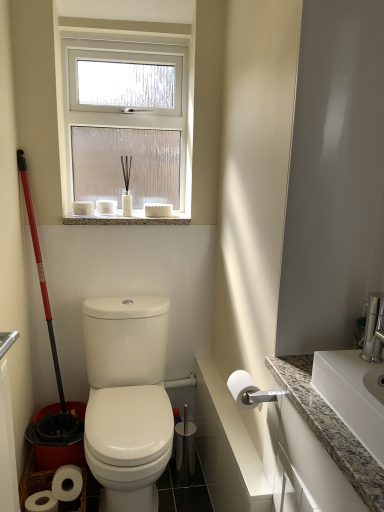
You are a GUI agent. You are given a task and a screenshot of the screen. Output one action in this format:
    pyautogui.click(x=<x>, y=<y>)
    Task: Click on the blank space situated above white granite sink at right (from a real-world perspective)
    
    Given the screenshot: What is the action you would take?
    pyautogui.click(x=364, y=370)